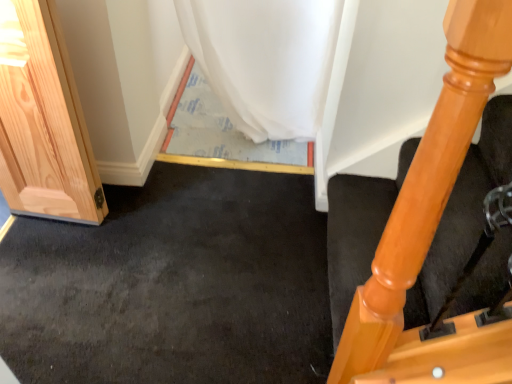
Describe the element at coordinates (46, 128) in the screenshot. Image resolution: width=512 pixels, height=384 pixels. I see `natural wood door at left` at that location.

The height and width of the screenshot is (384, 512). I want to click on natural wood door at left, so click(x=46, y=128).

I want to click on natural wood door at left, so click(x=46, y=128).